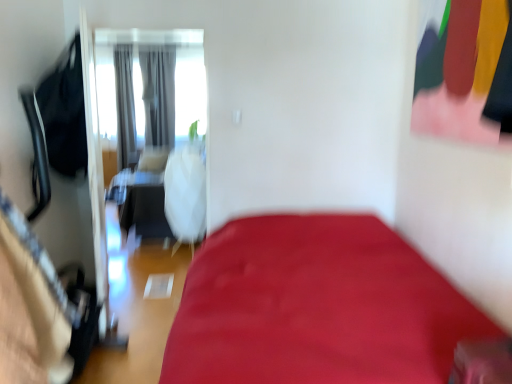
Question: Is gray fabric curtain at upper left, the 1th curtain in the left-to-right sequence, at the right side of white matte screen door at upper left?

Choices:
 (A) no
 (B) yes

Answer: (A)

Question: Can you confirm if gray fabric curtain at upper left, the 1th curtain in the left-to-right sequence, is shorter than white matte screen door at upper left?

Choices:
 (A) yes
 (B) no

Answer: (B)

Question: Can we say gray fabric curtain at upper left, the 1th curtain in the left-to-right sequence, lies outside white matte screen door at upper left?

Choices:
 (A) yes
 (B) no

Answer: (A)

Question: Considering the relative sizes of gray fabric curtain at upper left, the 1th curtain in the left-to-right sequence, and white matte screen door at upper left in the image provided, is gray fabric curtain at upper left, the 1th curtain in the left-to-right sequence, taller than white matte screen door at upper left?

Choices:
 (A) yes
 (B) no

Answer: (A)

Question: From the image's perspective, would you say gray fabric curtain at upper left, the 1th curtain in the left-to-right sequence, is positioned over white matte screen door at upper left?

Choices:
 (A) yes
 (B) no

Answer: (A)

Question: Which is correct: gray fabric curtain at center, the 2th curtain in the left-to-right sequence, is inside gray fabric curtain at upper left, which appears as the 2th curtain when viewed from the right, or outside of it?

Choices:
 (A) inside
 (B) outside

Answer: (B)

Question: In the image, is gray fabric curtain at center, the 1th curtain viewed from the right, positioned in front of or behind gray fabric curtain at upper left, the 1th curtain in the left-to-right sequence?

Choices:
 (A) behind
 (B) front

Answer: (A)

Question: Considering the positions of gray fabric curtain at center, the 2th curtain in the left-to-right sequence, and gray fabric curtain at upper left, the 1th curtain in the left-to-right sequence, in the image, is gray fabric curtain at center, the 2th curtain in the left-to-right sequence, taller or shorter than gray fabric curtain at upper left, the 1th curtain in the left-to-right sequence,?

Choices:
 (A) tall
 (B) short

Answer: (B)

Question: In the image, is gray fabric curtain at center, the 1th curtain viewed from the right, on the left side or the right side of gray fabric curtain at upper left, which appears as the 2th curtain when viewed from the right?

Choices:
 (A) right
 (B) left

Answer: (A)

Question: Considering the positions of gray fabric curtain at upper left, which appears as the 2th curtain when viewed from the right, and white matte screen door at upper left in the image, is gray fabric curtain at upper left, which appears as the 2th curtain when viewed from the right, taller or shorter than white matte screen door at upper left?

Choices:
 (A) tall
 (B) short

Answer: (A)

Question: Looking at their shapes, would you say gray fabric curtain at upper left, the 1th curtain in the left-to-right sequence, is wider or thinner than white matte screen door at upper left?

Choices:
 (A) thin
 (B) wide

Answer: (B)

Question: In the image, is gray fabric curtain at upper left, which appears as the 2th curtain when viewed from the right, positioned in front of or behind white matte screen door at upper left?

Choices:
 (A) behind
 (B) front

Answer: (A)

Question: Is gray fabric curtain at upper left, the 1th curtain in the left-to-right sequence, to the left or to the right of white matte screen door at upper left in the image?

Choices:
 (A) right
 (B) left

Answer: (B)

Question: In terms of height, does gray fabric curtain at center, the 1th curtain viewed from the right, look taller or shorter compared to white matte screen door at upper left?

Choices:
 (A) short
 (B) tall

Answer: (A)

Question: Looking at their shapes, would you say gray fabric curtain at center, the 2th curtain in the left-to-right sequence, is wider or thinner than white matte screen door at upper left?

Choices:
 (A) wide
 (B) thin

Answer: (A)